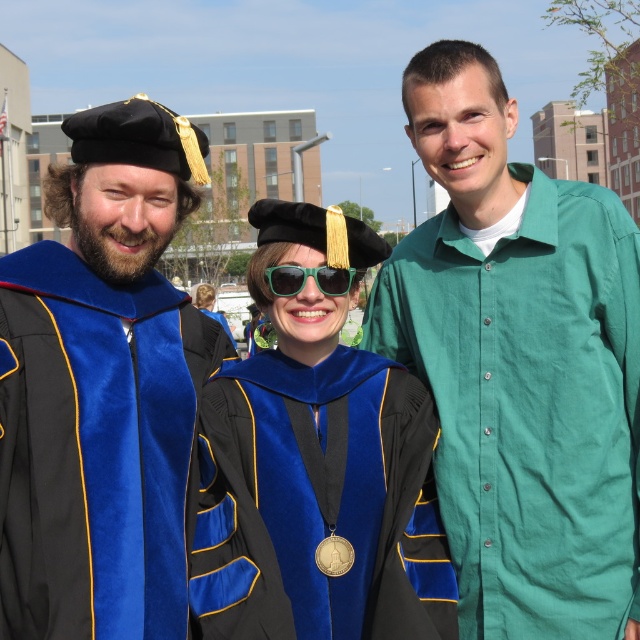
You are a photographer trying to capture a closeup shot of the central figure. You have two points marked in the image for focus adjustment. The first point is at point (42,248) and the second is at point (291,296). Which point should you choose to ensure the central figure is in focus?

Point (42,248) is closer to the viewer than point (291,296), so choosing this point will ensure the central figure is in focus.

You are a photographer trying to capture a candid shot of the green plastic sunglasses at center without including the velvet blue graduation gown at left in the frame. Given their relative heights, is this possible?

The velvet blue graduation gown at left is taller than green plastic sunglasses at center, so if the photographer positions themselves below the gown, they might be able to frame the shot to exclude the gown while focusing on the sunglasses.